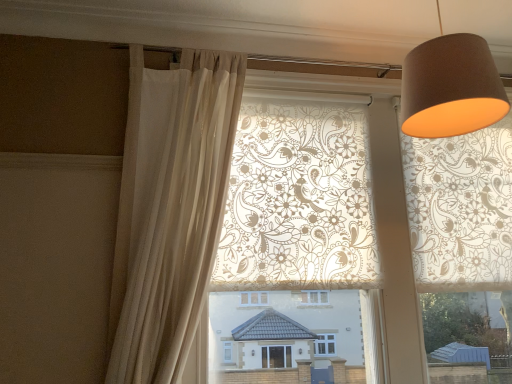
Question: From a real-world perspective, is sheer beige curtain at left located beneath matte brown lampshade at upper right?

Choices:
 (A) yes
 (B) no

Answer: (A)

Question: Can you confirm if sheer beige curtain at left is shorter than matte brown lampshade at upper right?

Choices:
 (A) yes
 (B) no

Answer: (B)

Question: Considering the relative sizes of sheer beige curtain at left and matte brown lampshade at upper right in the image provided, is sheer beige curtain at left bigger than matte brown lampshade at upper right?

Choices:
 (A) yes
 (B) no

Answer: (A)

Question: Considering the relative sizes of sheer beige curtain at left and matte brown lampshade at upper right in the image provided, is sheer beige curtain at left thinner than matte brown lampshade at upper right?

Choices:
 (A) no
 (B) yes

Answer: (B)

Question: Is sheer beige curtain at left not near matte brown lampshade at upper right?

Choices:
 (A) yes
 (B) no

Answer: (B)

Question: From the image's perspective, is sheer beige curtain at left above matte brown lampshade at upper right?

Choices:
 (A) yes
 (B) no

Answer: (B)

Question: From a real-world perspective, is matte brown lampshade at upper right below sheer beige curtain at left?

Choices:
 (A) yes
 (B) no

Answer: (B)

Question: Does matte brown lampshade at upper right have a lesser width compared to sheer beige curtain at left?

Choices:
 (A) yes
 (B) no

Answer: (B)

Question: From the image's perspective, is matte brown lampshade at upper right beneath sheer beige curtain at left?

Choices:
 (A) yes
 (B) no

Answer: (B)

Question: From a real-world perspective, is matte brown lampshade at upper right physically above sheer beige curtain at left?

Choices:
 (A) yes
 (B) no

Answer: (A)

Question: Is matte brown lampshade at upper right not close to sheer beige curtain at left?

Choices:
 (A) yes
 (B) no

Answer: (B)

Question: Does matte brown lampshade at upper right have a greater height compared to sheer beige curtain at left?

Choices:
 (A) yes
 (B) no

Answer: (B)

Question: Is sheer beige curtain at left in front of or behind matte brown lampshade at upper right in the image?

Choices:
 (A) front
 (B) behind

Answer: (B)